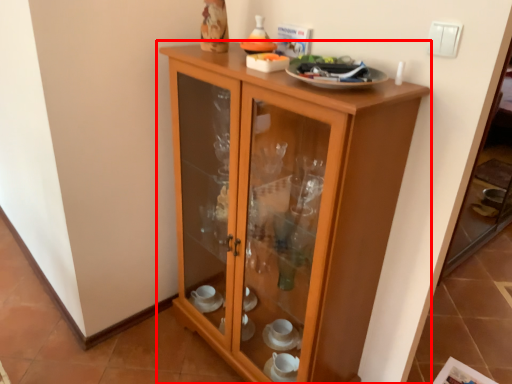
Question: From the image's perspective, where is cupboard (annotated by the red box) located in relation to light switch in the image?

Choices:
 (A) below
 (B) above

Answer: (A)